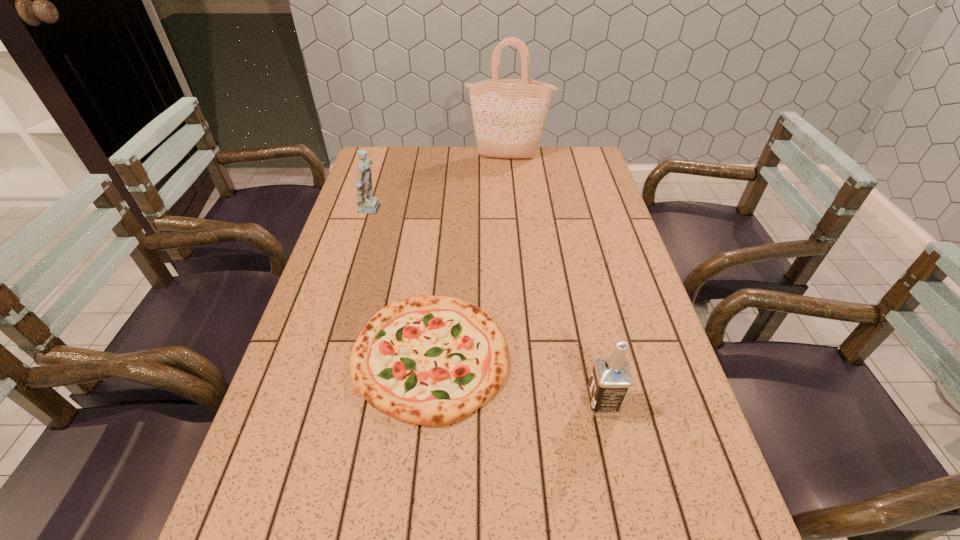
What are the coordinates of `vacant position at the far right corner of the desktop` in the screenshot? It's located at (574, 178).

Find the location of a particular element. Image resolution: width=960 pixels, height=540 pixels. vacant space that's between the shortest object and the vodka is located at coordinates (516, 380).

Locate an element on the screen. blank region between the tallest object and the pizza is located at coordinates (469, 257).

The height and width of the screenshot is (540, 960). I want to click on vacant area that lies between the pizza and the shopping bag, so click(469, 257).

Identify the location of empty space between the leftmost object and the pizza. (401, 284).

Locate an element on the screen. The image size is (960, 540). free space between the leftmost object and the shortest object is located at coordinates (401, 284).

Identify the location of free spot between the shortest object and the vodka. (516, 380).

This screenshot has height=540, width=960. I want to click on empty location between the leftmost object and the pizza, so click(x=401, y=284).

This screenshot has height=540, width=960. Find the location of `vacant point located between the vodka and the tallest object`. vacant point located between the vodka and the tallest object is located at coordinates (555, 280).

Locate an element on the screen. This screenshot has height=540, width=960. empty location between the leftmost object and the vodka is located at coordinates (487, 307).